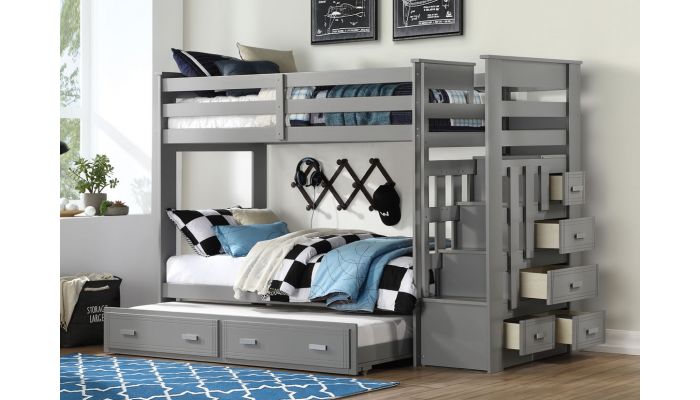
Image resolution: width=700 pixels, height=400 pixels. Find the location of `picture`. picture is located at coordinates (435, 15).